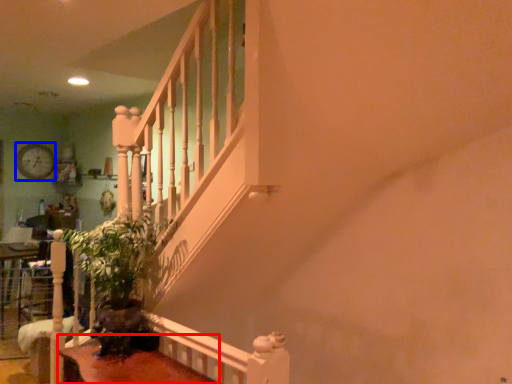
Question: Which object appears farthest to the camera in this image, table (highlighted by a red box) or clock (highlighted by a blue box)?

Choices:
 (A) table
 (B) clock

Answer: (B)